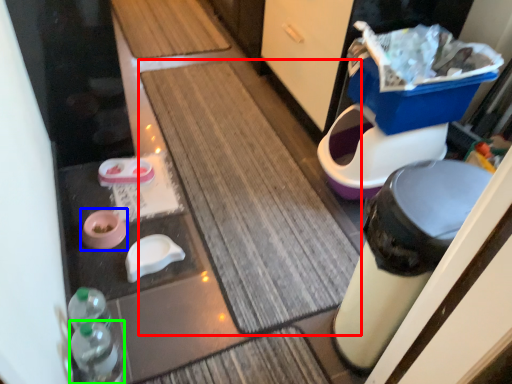
Question: Based on their relative distances, which object is farther from bath mat (highlighted by a red box)? Choose from potty (highlighted by a blue box) and bottle (highlighted by a green box).

Choices:
 (A) potty
 (B) bottle

Answer: (B)